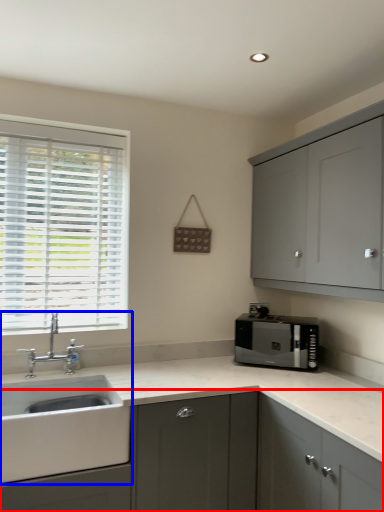
Question: Which object is closer to the camera taking this photo, cabinetry (highlighted by a red box) or sink (highlighted by a blue box)?

Choices:
 (A) cabinetry
 (B) sink

Answer: (A)